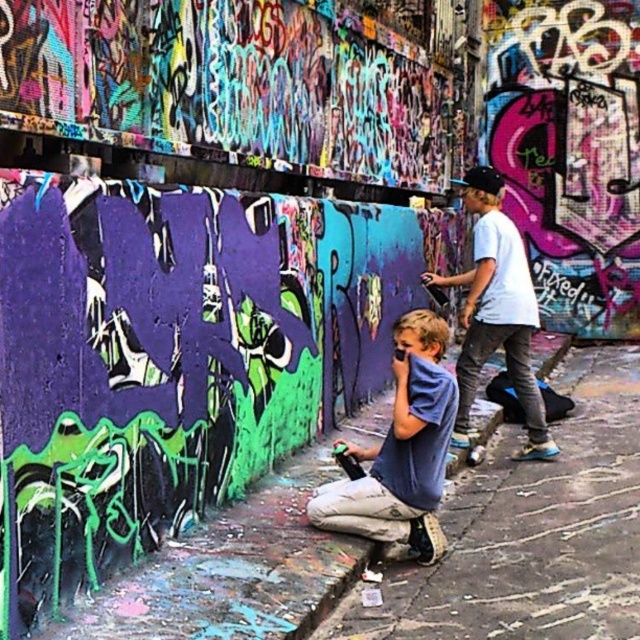
Consider the image. Which is more to the left, matte blue t-shirt at center or light blue denim jeans at center?

matte blue t-shirt at center

Can you confirm if matte blue t-shirt at center is thinner than light blue denim jeans at center?

Yes, matte blue t-shirt at center is thinner than light blue denim jeans at center.

What do you see at coordinates (401, 451) in the screenshot?
I see `matte blue t-shirt at center` at bounding box center [401, 451].

Find the location of a particular element. The height and width of the screenshot is (640, 640). matte blue t-shirt at center is located at coordinates (401, 451).